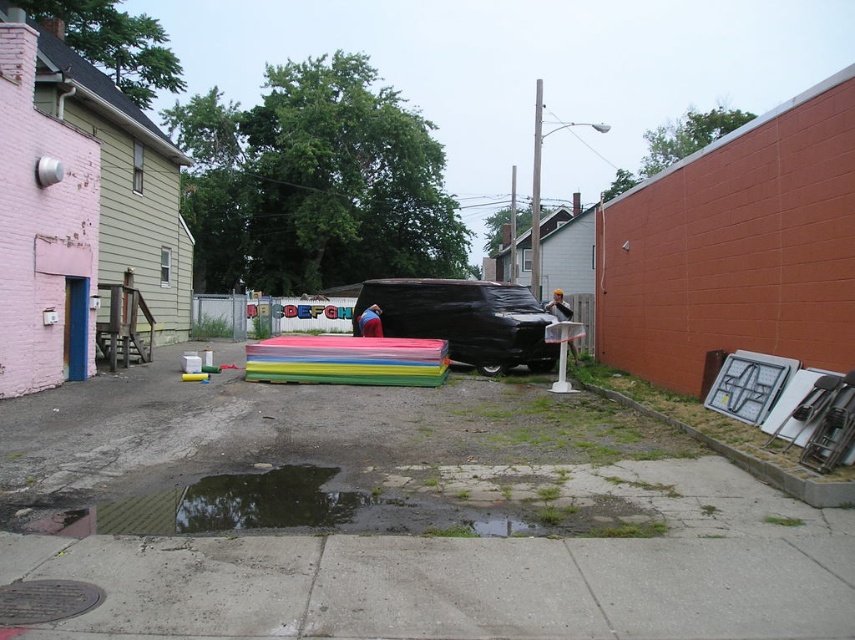
Question: In this image, where is concrete pavement at center located relative to black matte van at center?

Choices:
 (A) below
 (B) above

Answer: (A)

Question: Which object is closer to the camera taking this photo?

Choices:
 (A) concrete pavement at center
 (B) brick at lower right
 (C) black matte van at center

Answer: (A)

Question: Is black matte van at center thinner than brick at lower right?

Choices:
 (A) no
 (B) yes

Answer: (A)

Question: Which object is closer to the camera taking this photo?

Choices:
 (A) black matte van at center
 (B) concrete pavement at center
 (C) brick at lower right

Answer: (B)

Question: Observing the image, what is the correct spatial positioning of black matte van at center in reference to brick at lower right?

Choices:
 (A) right
 (B) left

Answer: (B)

Question: Which point is farther from the camera taking this photo?

Choices:
 (A) (753, 460)
 (B) (441, 310)
 (C) (60, 548)

Answer: (B)